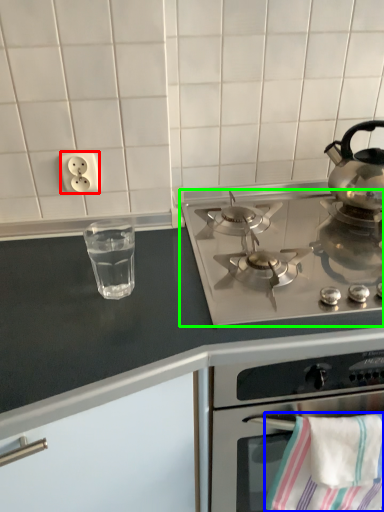
Question: Considering the real-world distances, which object is farthest from electric outlet (highlighted by a red box)? beach towel (highlighted by a blue box) or gas stove (highlighted by a green box)?

Choices:
 (A) beach towel
 (B) gas stove

Answer: (A)